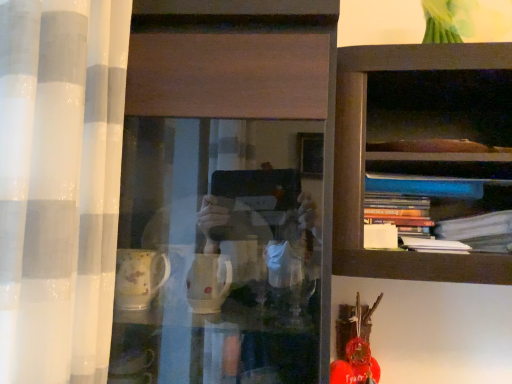
At what (x,y) coordinates should I click in order to perform the action: click on hardcover book at upper right. Please return your answer as a coordinate pair (x, y). The width and height of the screenshot is (512, 384). Looking at the image, I should click on (399, 213).

Image resolution: width=512 pixels, height=384 pixels. What do you see at coordinates (399, 213) in the screenshot? I see `hardcover book at upper right` at bounding box center [399, 213].

Identify the location of hardcover book at upper right. The image size is (512, 384). coord(399,213).